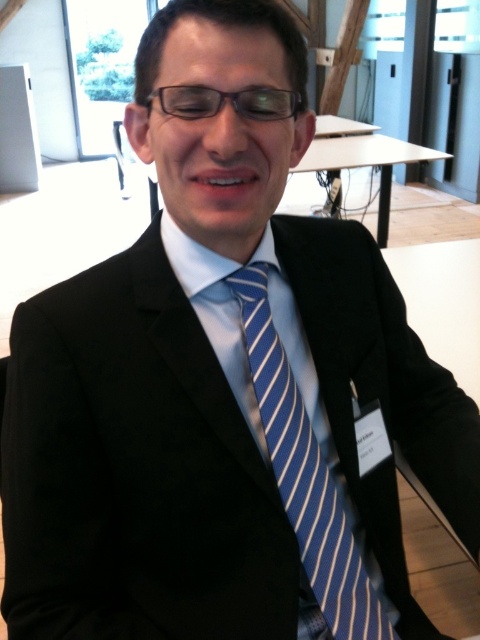
Question: Does blue striped tie at center have a smaller size compared to transparent plastic glasses at center?

Choices:
 (A) yes
 (B) no

Answer: (B)

Question: Which point is closer to the camera?

Choices:
 (A) white matte table at upper center
 (B) transparent plastic glasses at center

Answer: (B)

Question: Can you confirm if blue striped tie at center is thinner than transparent plastic glasses at center?

Choices:
 (A) no
 (B) yes

Answer: (A)

Question: Among these points, which one is nearest to the camera?

Choices:
 (A) (336, 170)
 (B) (215, 92)
 (C) (321, 468)

Answer: (B)

Question: Which object appears closest to the camera in this image?

Choices:
 (A) white matte table at upper center
 (B) blue striped tie at center

Answer: (B)

Question: Is white matte table at upper center to the right of transparent plastic glasses at center from the viewer's perspective?

Choices:
 (A) no
 (B) yes

Answer: (B)